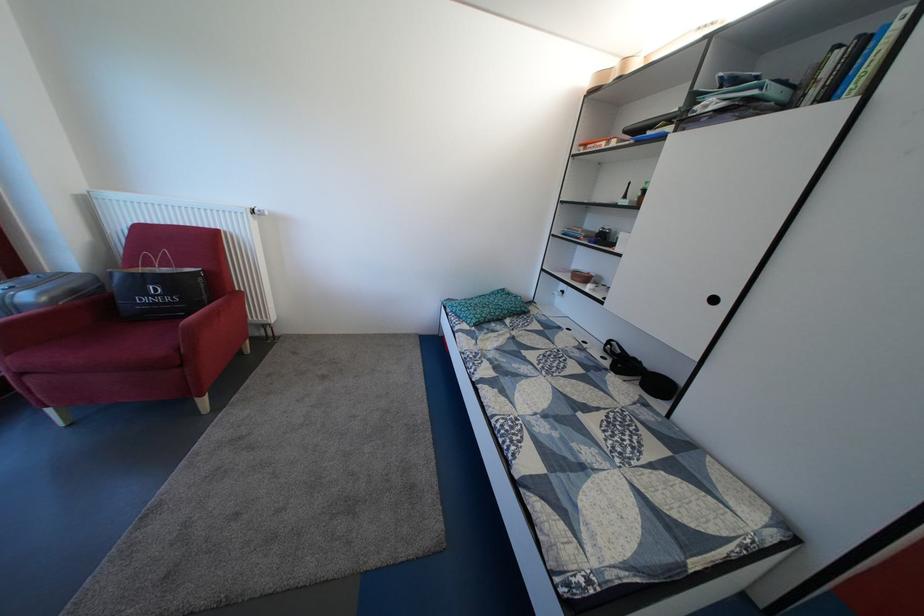
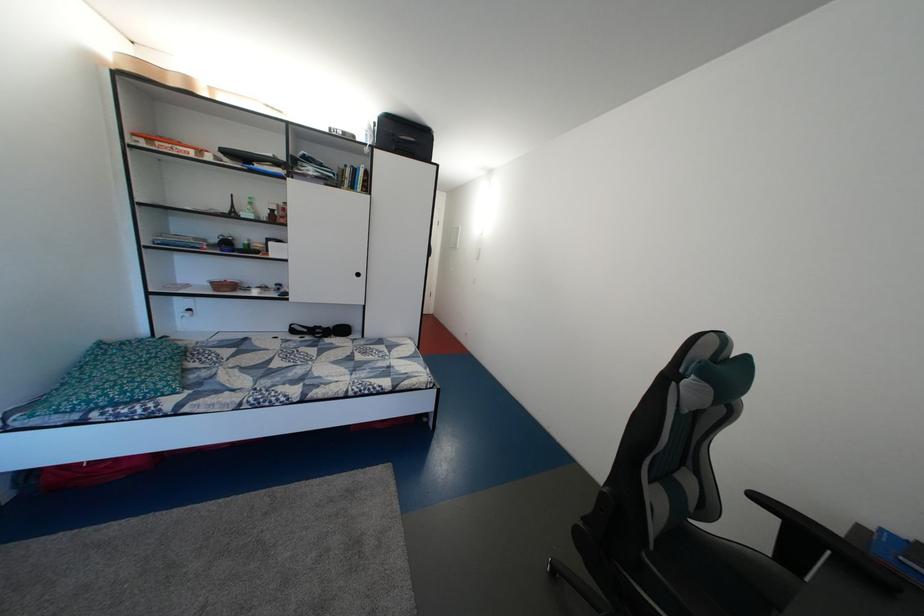
Locate, in the second image, the point that corresponds to (x=546, y=436) in the first image.

(373, 382)